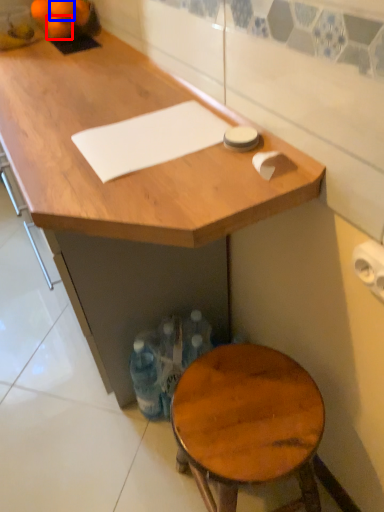
Question: Which object is closer to the camera taking this photo, tangerine (highlighted by a red box) or tangerine (highlighted by a blue box)?

Choices:
 (A) tangerine
 (B) tangerine

Answer: (B)